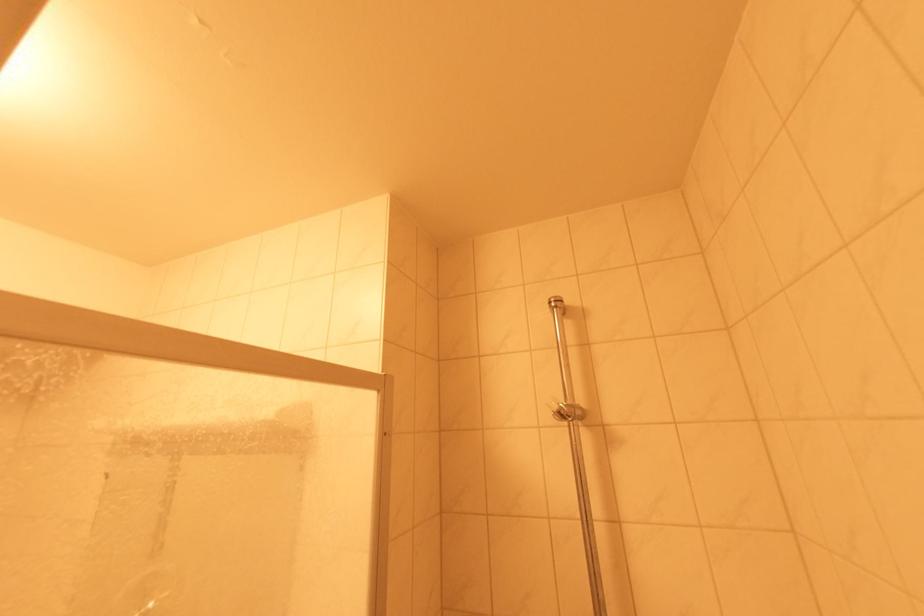
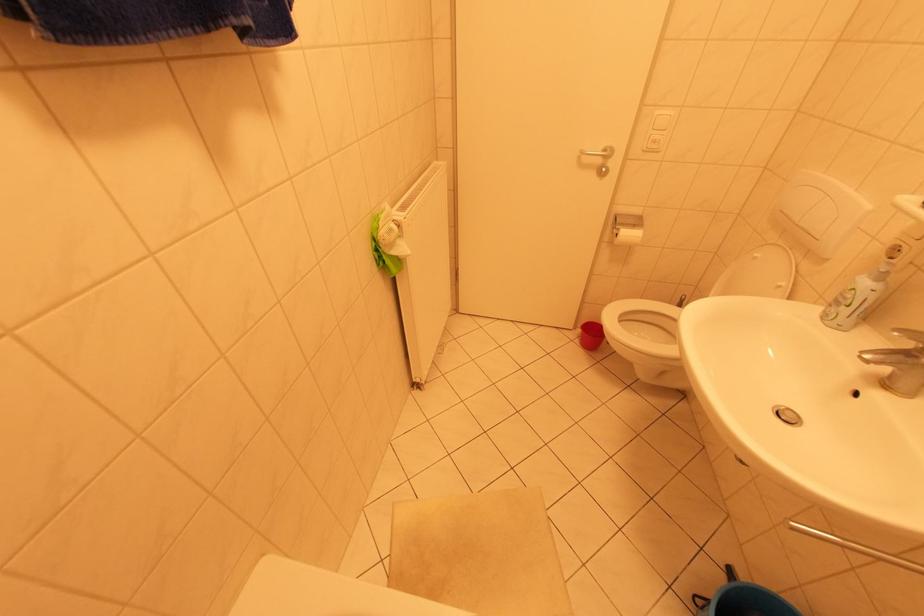
The first image is from the beginning of the video and the second image is from the end. How did the camera likely rotate when shooting the video?

The camera rotated toward left-down.